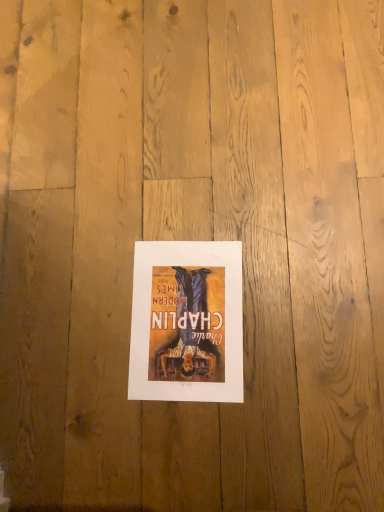
At what (x,y) coordinates should I click in order to perform the action: click on unoccupied region to the right of matte paper poster at center. Please return your answer as a coordinate pair (x, y). Looking at the image, I should click on (297, 270).